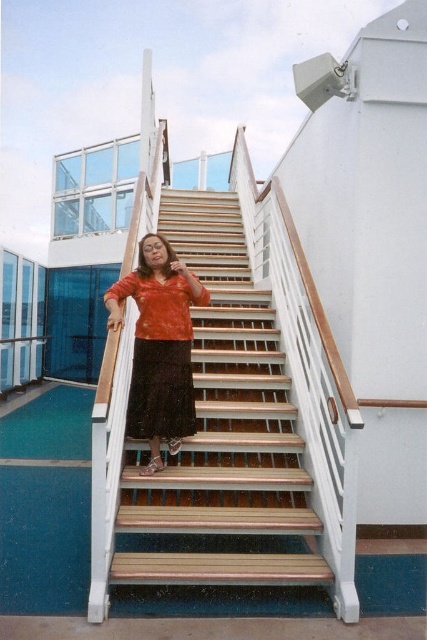
You are a photographer planning to capture a wide shot of the scene. Given that the wooden stairs at center and the matte orange blouse at center are in the frame, which object occupies more horizontal space in the image?

The wooden stairs at center occupies more horizontal space than the matte orange blouse at center because its width surpasses that of the blouse according to the description.

You are a photographer trying to capture a shot of the wooden stairs at center and the matte orange blouse at center from the left side of the scene. Which object will appear closer to the left edge of your photo?

The matte orange blouse at center is to the right of the wooden stairs at center, so the wooden stairs at center will be closer to the left edge of the photo.